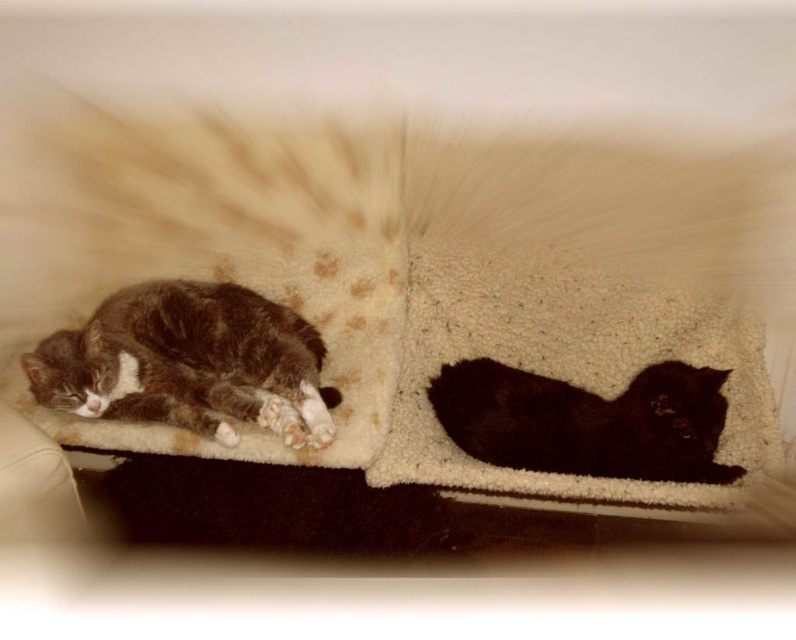
From the picture: Does gray fur cat at left have a greater height compared to shiny black cat at center?

Yes.

This screenshot has height=640, width=796. What are the coordinates of `gray fur cat at left` in the screenshot? It's located at (189, 364).

Where is `gray fur cat at left`? The width and height of the screenshot is (796, 640). gray fur cat at left is located at coordinates (189, 364).